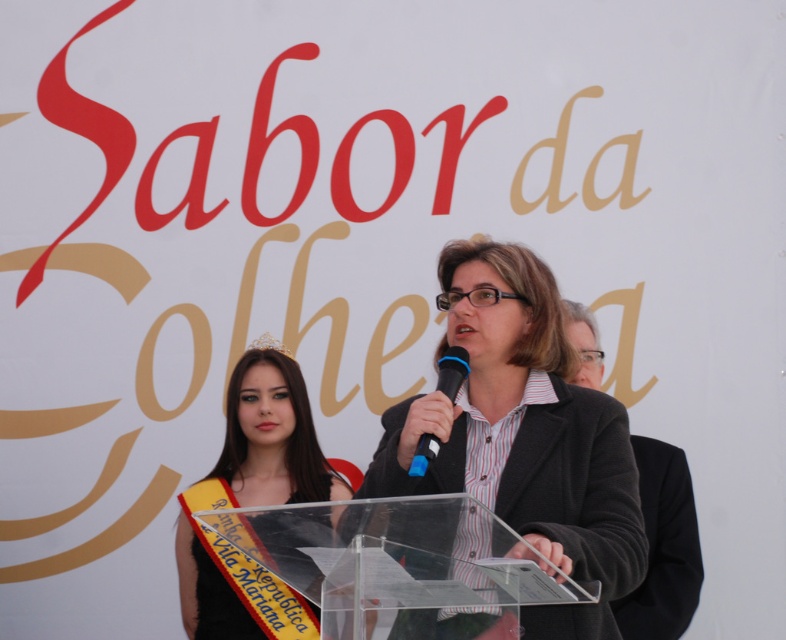
Question: Which point is closer to the camera taking this photo?

Choices:
 (A) (590, 332)
 (B) (605, 440)
 (C) (450, 353)
 (D) (278, 352)

Answer: (C)

Question: Among these points, which one is farthest from the camera?

Choices:
 (A) (579, 380)
 (B) (529, 531)
 (C) (267, 339)

Answer: (C)

Question: Considering the real-world distances, which object is closest to the matte black jacket at center?

Choices:
 (A) black wool coat at center
 (B) blue plastic microphone at center
 (C) yellow satin sash at left
 (D) gold metallic tiara at upper center

Answer: (B)

Question: Considering the relative positions of yellow satin sash at left and black wool coat at center in the image provided, where is yellow satin sash at left located with respect to black wool coat at center?

Choices:
 (A) right
 (B) left

Answer: (B)

Question: Is black wool coat at center positioned behind gold metallic tiara at upper center?

Choices:
 (A) no
 (B) yes

Answer: (A)

Question: Is yellow satin sash at left in front of black wool coat at center?

Choices:
 (A) no
 (B) yes

Answer: (B)